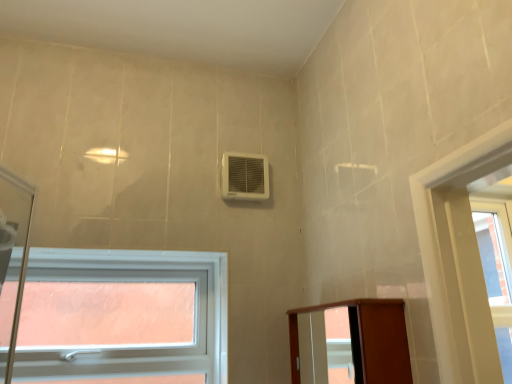
Question: Should I look upward or downward to see white plastic window at lower left?

Choices:
 (A) up
 (B) down

Answer: (B)

Question: Is white plastic air conditioning unit at upper center further to camera compared to white plastic window at lower left?

Choices:
 (A) no
 (B) yes

Answer: (B)

Question: From a real-world perspective, is white plastic air conditioning unit at upper center positioned under white plastic window at lower left based on gravity?

Choices:
 (A) yes
 (B) no

Answer: (B)

Question: From a real-world perspective, is white plastic air conditioning unit at upper center located higher than white plastic window at lower left?

Choices:
 (A) yes
 (B) no

Answer: (A)

Question: Can you confirm if white plastic air conditioning unit at upper center is thinner than white plastic window at lower left?

Choices:
 (A) yes
 (B) no

Answer: (A)

Question: From the image's perspective, is white plastic air conditioning unit at upper center over white plastic window at lower left?

Choices:
 (A) no
 (B) yes

Answer: (B)

Question: Would you say white plastic air conditioning unit at upper center is a long distance from white plastic window at lower left?

Choices:
 (A) no
 (B) yes

Answer: (A)

Question: Is brown wood elevator at lower right completely or partially inside white plastic window at lower left?

Choices:
 (A) no
 (B) yes

Answer: (A)

Question: Considering the relative positions of white plastic window at lower left and brown wood elevator at lower right in the image provided, is white plastic window at lower left behind brown wood elevator at lower right?

Choices:
 (A) yes
 (B) no

Answer: (A)

Question: From the image's perspective, is white plastic window at lower left under brown wood elevator at lower right?

Choices:
 (A) yes
 (B) no

Answer: (A)

Question: Considering the relative sizes of white plastic window at lower left and brown wood elevator at lower right in the image provided, is white plastic window at lower left thinner than brown wood elevator at lower right?

Choices:
 (A) yes
 (B) no

Answer: (A)

Question: Is white plastic window at lower left not near brown wood elevator at lower right?

Choices:
 (A) yes
 (B) no

Answer: (B)

Question: Can you confirm if white plastic window at lower left is smaller than brown wood elevator at lower right?

Choices:
 (A) yes
 (B) no

Answer: (B)

Question: Can you confirm if brown wood elevator at lower right is thinner than white plastic window at lower left?

Choices:
 (A) no
 (B) yes

Answer: (A)